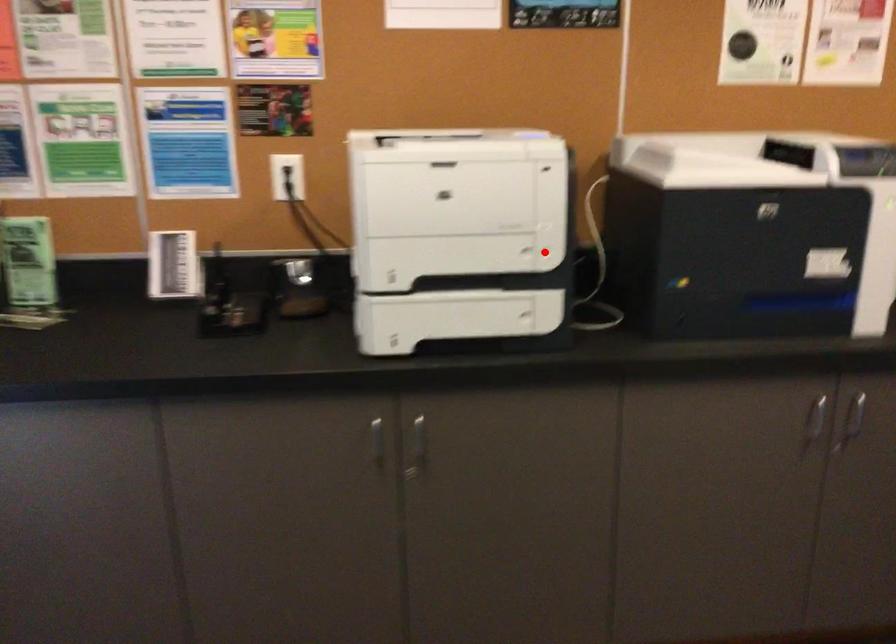
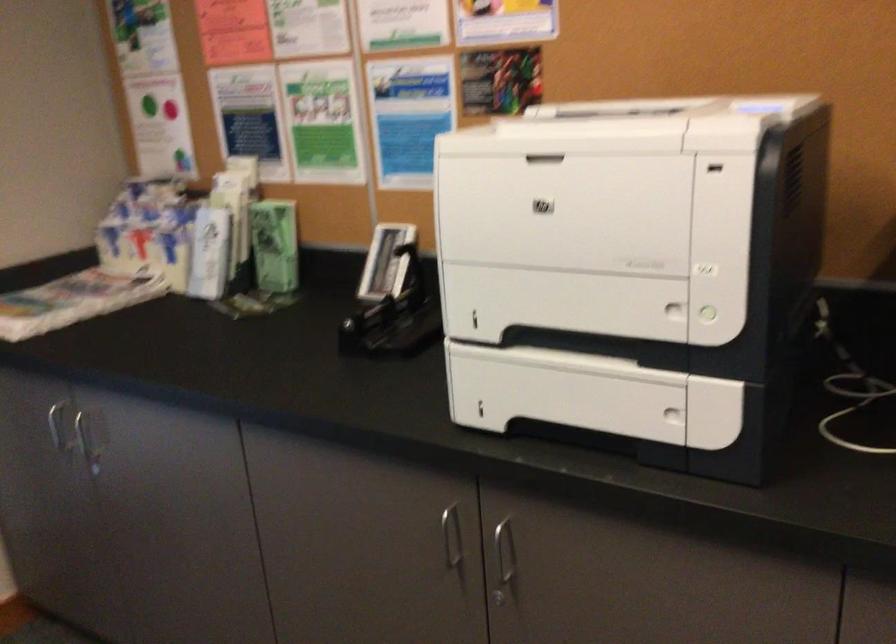
The point at the highlighted location is marked in the first image. Where is the corresponding point in the second image?

(709, 314)